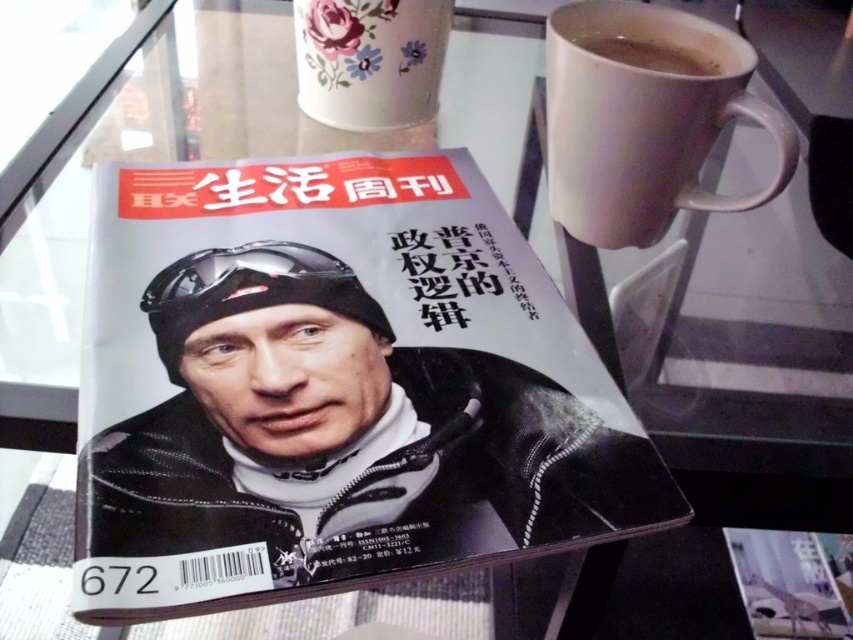
Question: Can you confirm if white matte mug at upper right is positioned below floral ceramic mug at upper center?

Choices:
 (A) yes
 (B) no

Answer: (A)

Question: Which point is farther to the camera?

Choices:
 (A) tap(674, 99)
 (B) tap(637, 40)
 (C) tap(358, 92)
 (D) tap(158, 426)

Answer: (C)

Question: Can you confirm if matte black magazine at center is wider than brown matte mug at upper right?

Choices:
 (A) no
 (B) yes

Answer: (B)

Question: Which point is farther to the camera?

Choices:
 (A) matte black magazine at center
 (B) brown matte mug at upper right
 (C) white matte mug at upper right
 (D) floral ceramic mug at upper center

Answer: (D)

Question: Can you confirm if matte black magazine at center is positioned to the left of white matte mug at upper right?

Choices:
 (A) no
 (B) yes

Answer: (B)

Question: Considering the real-world distances, which object is closest to the white matte mug at upper right?

Choices:
 (A) floral ceramic mug at upper center
 (B) matte black magazine at center

Answer: (B)